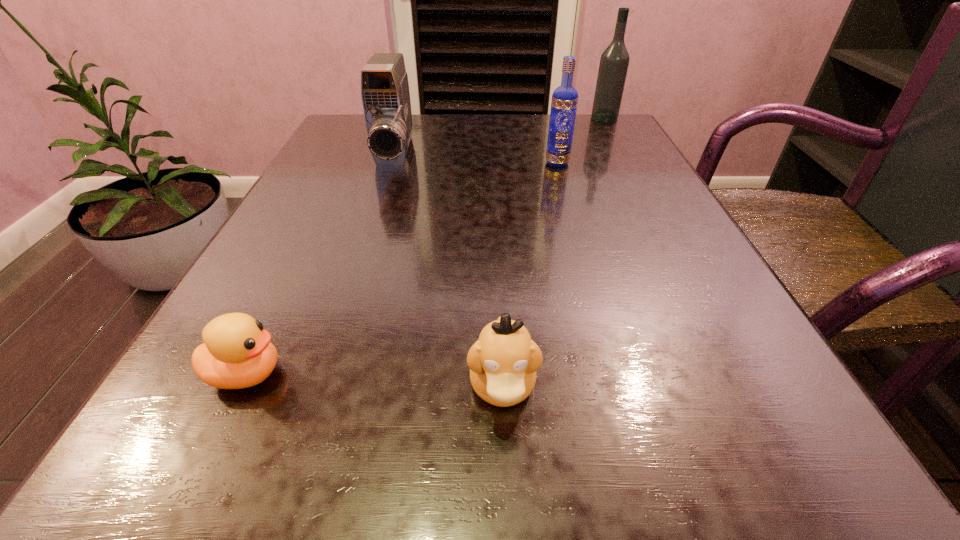
At what (x,y) coordinates should I click in order to perform the action: click on vacant region located 0.210m on the left of the shorter vodka. Please return your answer as a coordinate pair (x, y). Image resolution: width=960 pixels, height=540 pixels. Looking at the image, I should click on (444, 163).

Where is `vacant space positioned 0.360m at the front of the camcorder, highlighting the lens`? vacant space positioned 0.360m at the front of the camcorder, highlighting the lens is located at coordinates (343, 316).

The height and width of the screenshot is (540, 960). I want to click on free space located on the face of the leftmost object, so click(x=381, y=374).

Find the location of a particular element. camcorder that is at the far edge is located at coordinates (385, 94).

You are a GUI agent. You are given a task and a screenshot of the screen. Output one action in this format:
    pyautogui.click(x=<x>, y=<y>)
    Task: Click on the object present at the near edge
    The image size is (960, 540).
    Given the screenshot: What is the action you would take?
    pyautogui.click(x=503, y=362)

Find the location of a particular element. The height and width of the screenshot is (540, 960). camcorder that is positioned at the left edge is located at coordinates (385, 94).

You are a GUI agent. You are given a task and a screenshot of the screen. Output one action in this format:
    pyautogui.click(x=<x>, y=<y>)
    Task: Click on the duckling that is at the left edge
    This screenshot has width=960, height=540.
    Given the screenshot: What is the action you would take?
    pos(236,353)

In order to click on object that is positioned at the far left corner in this screenshot , I will do `click(385, 94)`.

Where is `vacant position at the far edge of the desktop`? This screenshot has height=540, width=960. vacant position at the far edge of the desktop is located at coordinates (417, 131).

Where is `blank area at the left edge`? The height and width of the screenshot is (540, 960). blank area at the left edge is located at coordinates (270, 312).